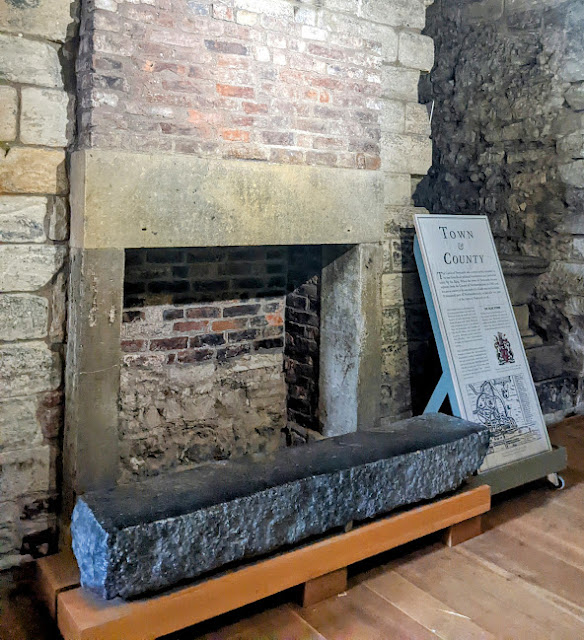
The width and height of the screenshot is (584, 640). I want to click on fireplace back wall, so click(198, 319).